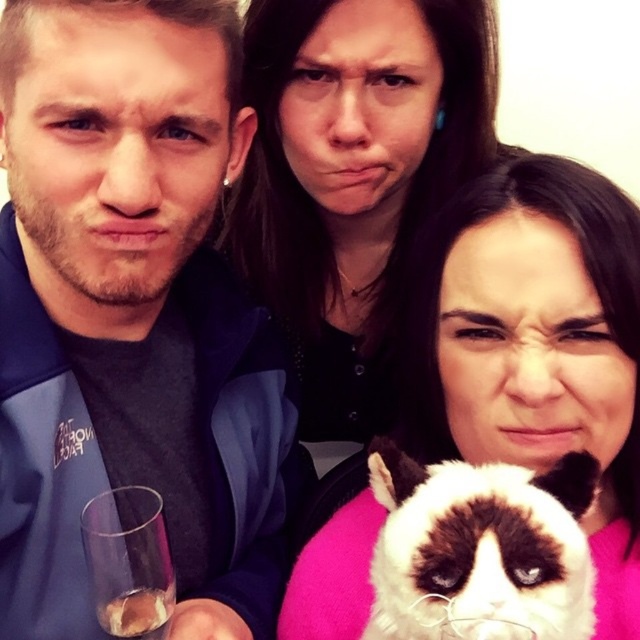
Question: Which point is closer to the camera?

Choices:
 (A) fluffy white cat at lower center
 (B) matte blue jacket at left
 (C) black matte hair at center
 (D) transparent glass at lower left

Answer: (A)

Question: Which point appears farthest from the camera in this image?

Choices:
 (A) (118, 554)
 (B) (452, 502)

Answer: (A)

Question: Can you confirm if matte blue jacket at left is bigger than black matte hair at center?

Choices:
 (A) yes
 (B) no

Answer: (B)

Question: Considering the relative positions of matte blue jacket at left and black matte hair at center in the image provided, where is matte blue jacket at left located with respect to black matte hair at center?

Choices:
 (A) right
 (B) left

Answer: (B)

Question: Is matte black cat at center to the right of black matte hair at center from the viewer's perspective?

Choices:
 (A) no
 (B) yes

Answer: (B)

Question: Which object appears closest to the camera in this image?

Choices:
 (A) matte blue jacket at left
 (B) fluffy white cat at lower center

Answer: (B)